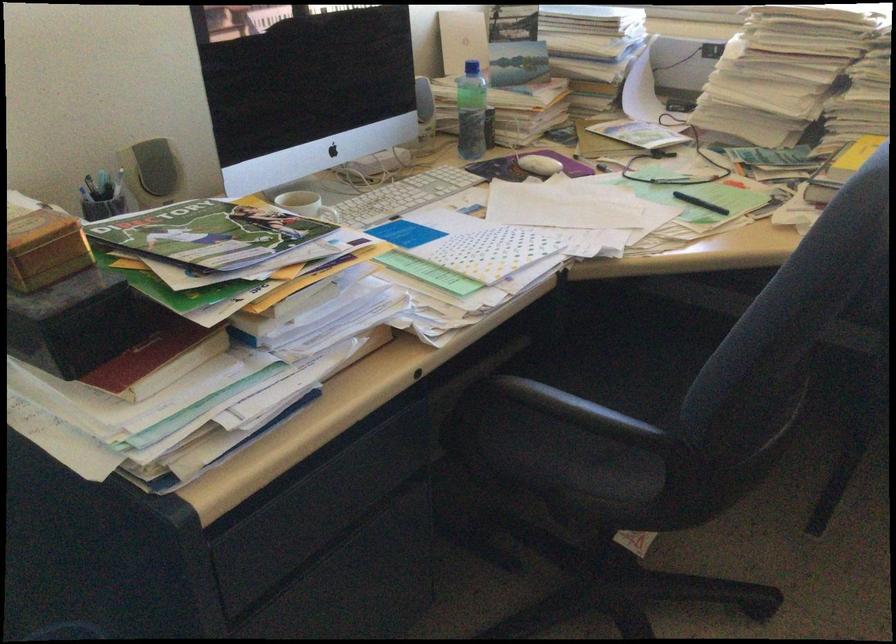
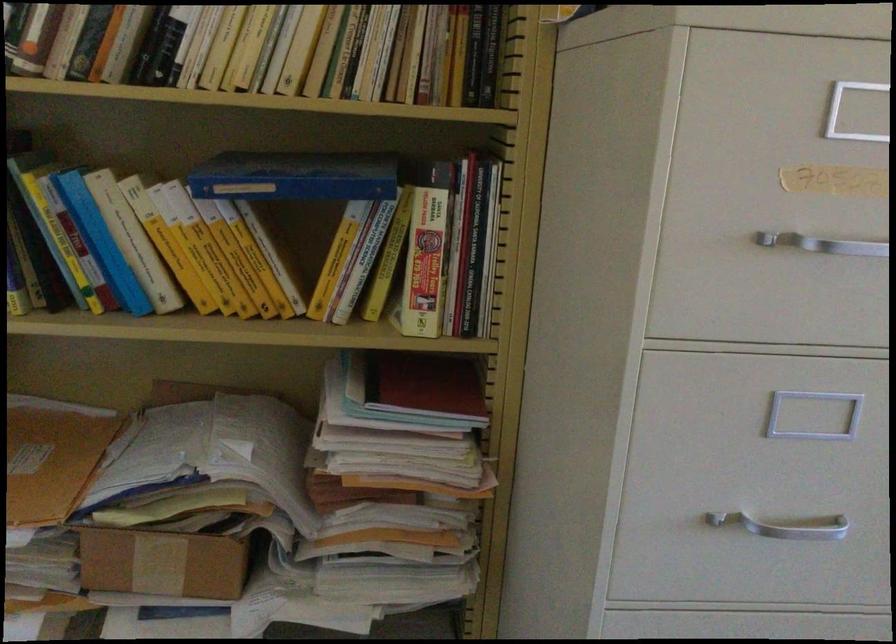
Question: The first image is from the beginning of the video and the second image is from the end. How did the camera likely rotate when shooting the video?

Choices:
 (A) Left
 (B) Right
 (C) Up
 (D) Down

Answer: (A)